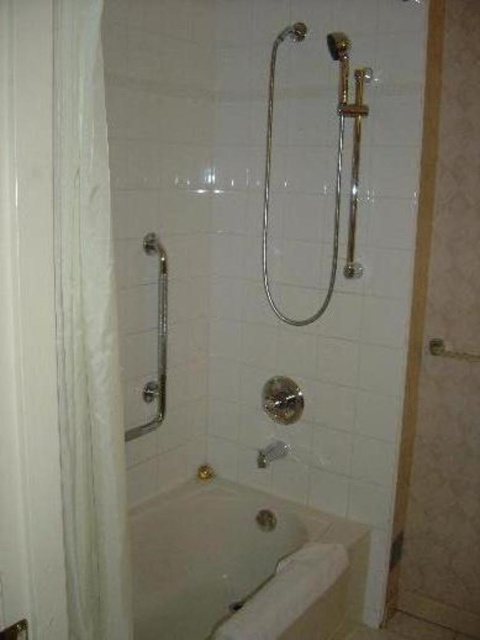
Question: Does white glossy bathtub at lower center appear on the left side of satin nickel showerhead at upper center?

Choices:
 (A) no
 (B) yes

Answer: (B)

Question: Which object is positioned farthest from the white glossy bathtub at lower center?

Choices:
 (A) silver metallic shower head at upper center
 (B) silver metallic grab bar at upper left

Answer: (A)

Question: Is white wood screen door at left smaller than silver metallic grab bar at upper left?

Choices:
 (A) no
 (B) yes

Answer: (B)

Question: In this image, where is white glossy bathtub at lower center located relative to silver metallic shower head at upper center?

Choices:
 (A) below
 (B) above

Answer: (A)

Question: Among these points, which one is nearest to the camera?

Choices:
 (A) (158, 340)
 (B) (288, 28)
 (C) (166, 561)
 (D) (12, 4)

Answer: (D)

Question: Which object is closer to the camera taking this photo?

Choices:
 (A) silver metallic grab bar at upper left
 (B) satin nickel showerhead at upper center
 (C) silver metallic shower head at upper center
 (D) white glossy bathtub at lower center

Answer: (D)